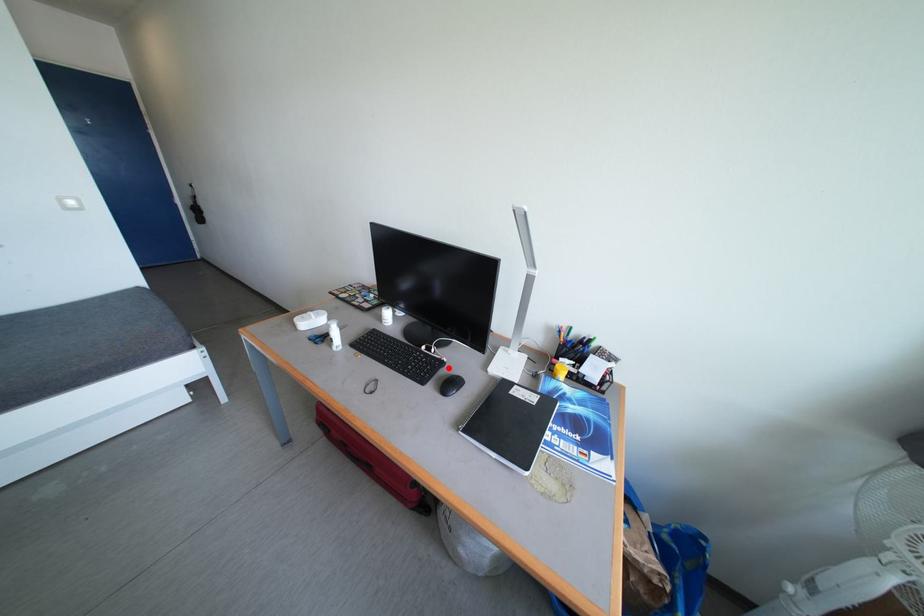
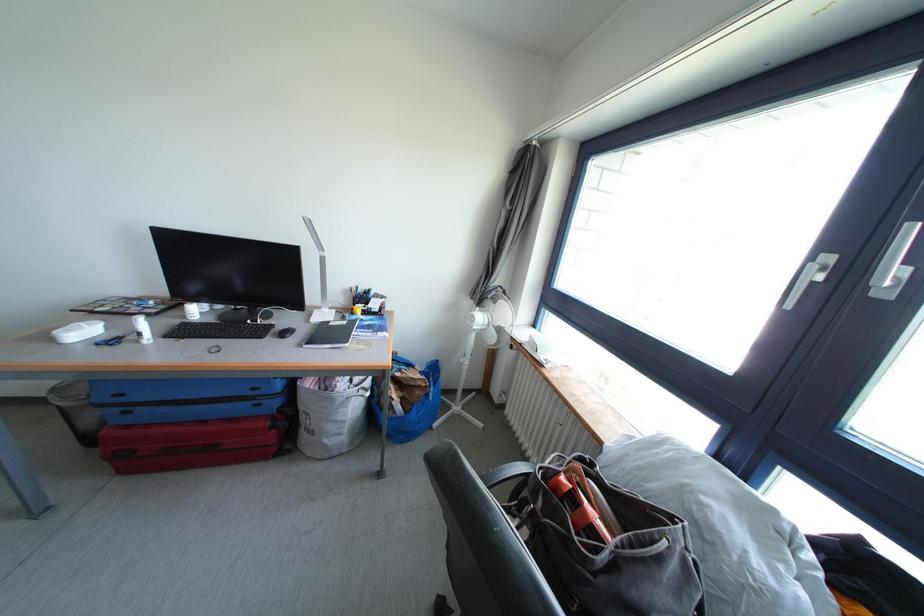
In the second image, find the point that corresponds to the highlighted location in the first image.

(278, 331)